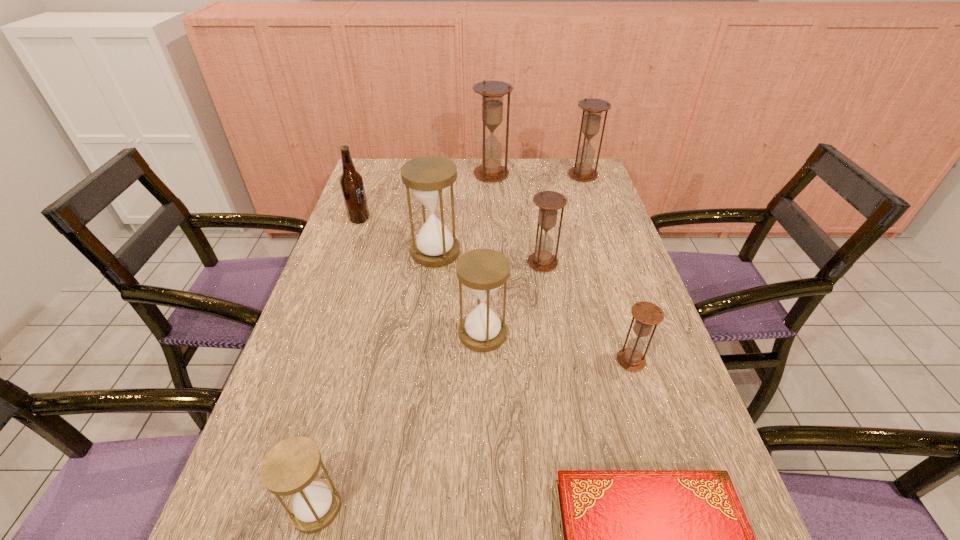
Identify the location of vacant position in the image that satisfies the following two spatial constraints: 1. on the back side of the seventh object from right to left; 2. on the right side of the smallest white hourglass. (382, 252).